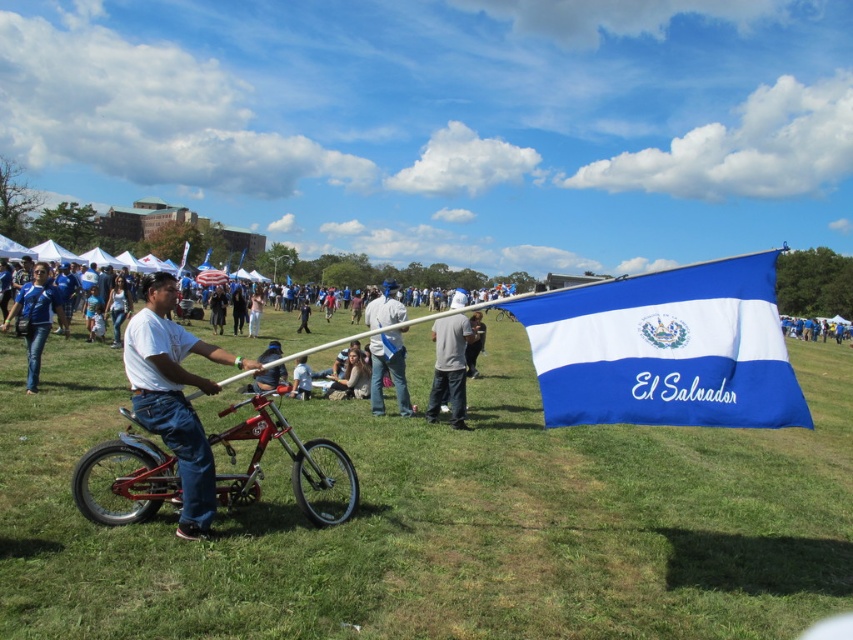
You are a photographer standing in the park and want to take a photo that includes both the blue fabric flag at center and the matte blue shirt at left. Which object should you focus on first to ensure both are in sharp focus?

The blue fabric flag at center is closer to the viewer than the matte blue shirt at left, so focus on the blue fabric flag at center first to ensure both are in sharp focus.